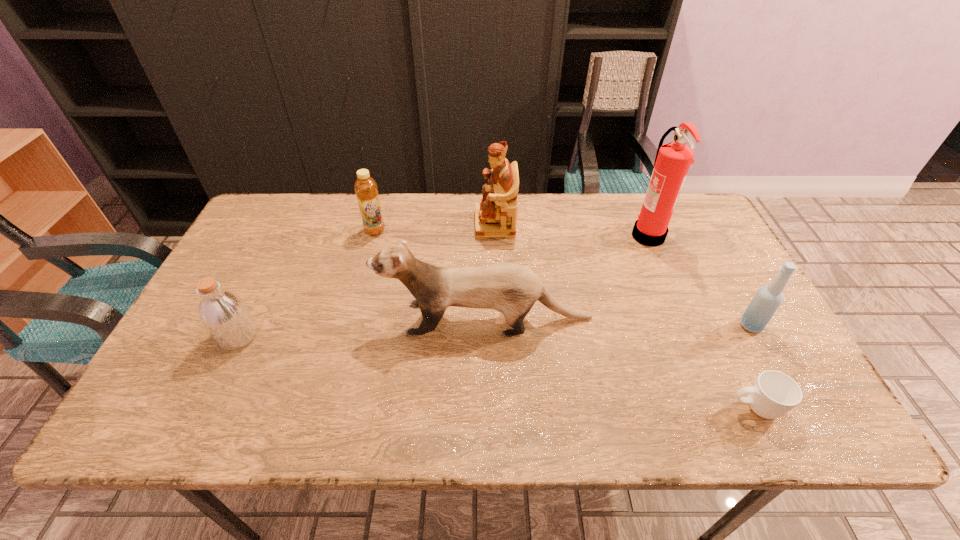
Locate an element on the screen. object that is the fifth closest to the shortest object is located at coordinates (365, 187).

Identify the location of the closest object to the leftmost object. The height and width of the screenshot is (540, 960). (512, 289).

Point out which bottle is positioned as the second nearest to the fire extinguisher. Please provide its 2D coordinates. Your answer should be formatted as a tuple, i.e. [(x, y)], where the tuple contains the x and y coordinates of a point satisfying the conditions above.

[(365, 187)]

The image size is (960, 540). I want to click on bottle that stands as the second closest to the tallest object, so click(x=365, y=187).

You are a GUI agent. You are given a task and a screenshot of the screen. Output one action in this format:
    pyautogui.click(x=<x>, y=<y>)
    Task: Click on the vacant space that satisfies the following two spatial constraints: 1. with the nozzle aimed from the tallest object; 2. on the back side of the rightmost object
    
    Given the screenshot: What is the action you would take?
    pyautogui.click(x=685, y=326)

You are a GUI agent. You are given a task and a screenshot of the screen. Output one action in this format:
    pyautogui.click(x=<x>, y=<y>)
    Task: Click on the vacant region that satisfies the following two spatial constraints: 1. on the face of the ferret; 2. on the front side of the leftmost object
    
    Given the screenshot: What is the action you would take?
    pyautogui.click(x=486, y=336)

Locate an element on the screen. The width and height of the screenshot is (960, 540). vacant space that satisfies the following two spatial constraints: 1. on the back side of the rightmost object; 2. on the front-facing side of the figurine is located at coordinates (694, 224).

Locate an element on the screen. free space that satisfies the following two spatial constraints: 1. on the front-facing side of the figurine; 2. on the back side of the rightmost object is located at coordinates (499, 326).